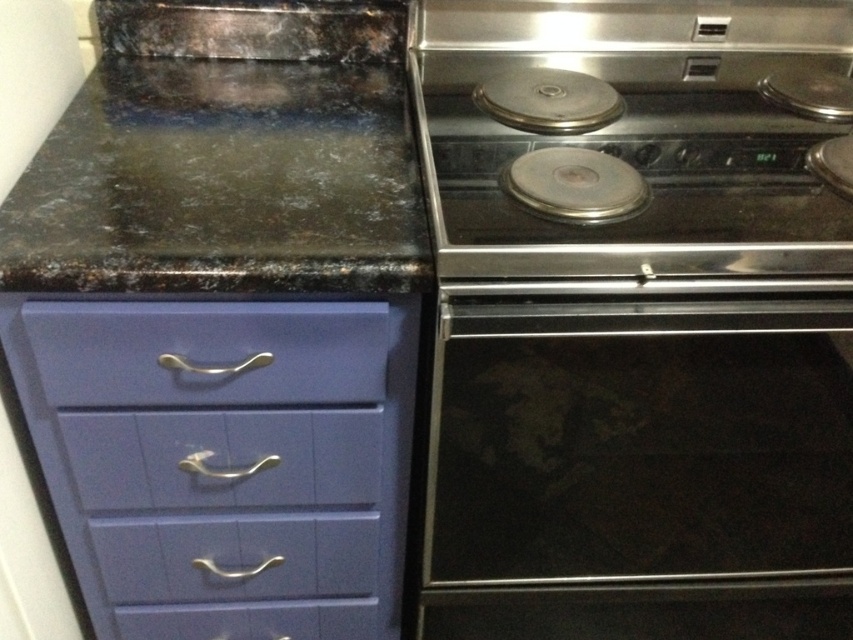
Question: From the image, what is the correct spatial relationship of black glass oven at center in relation to shiny metallic stove at upper right?

Choices:
 (A) left
 (B) right

Answer: (B)

Question: Which point is closer to the camera?

Choices:
 (A) (206, 323)
 (B) (634, 236)
 (C) (305, 365)

Answer: (A)

Question: Is black glass oven at center to the left of matte blue drawer at lower left from the viewer's perspective?

Choices:
 (A) yes
 (B) no

Answer: (B)

Question: Which object is farther from the camera taking this photo?

Choices:
 (A) purple glossy drawer at lower left
 (B) shiny metallic stove at upper right
 (C) black granite countertop at upper left
 (D) matte blue drawer at lower left

Answer: (D)

Question: Is the position of black glass oven at center more distant than that of matte blue drawer at lower left?

Choices:
 (A) no
 (B) yes

Answer: (A)

Question: Which object is farther from the camera taking this photo?

Choices:
 (A) purple glossy drawer at lower left
 (B) matte purple drawer at center
 (C) black glass oven at center
 (D) matte blue drawer at lower left

Answer: (B)